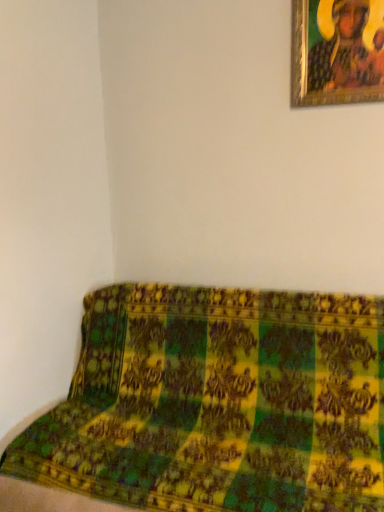
Question: Is green fabric couch at lower right at the right side of gold-framed painting at upper right?

Choices:
 (A) yes
 (B) no

Answer: (B)

Question: Is green fabric couch at lower right far from gold-framed painting at upper right?

Choices:
 (A) yes
 (B) no

Answer: (A)

Question: Can you confirm if green fabric couch at lower right is positioned to the left of gold-framed painting at upper right?

Choices:
 (A) yes
 (B) no

Answer: (A)

Question: Is green fabric couch at lower right next to gold-framed painting at upper right and touching it?

Choices:
 (A) yes
 (B) no

Answer: (B)

Question: From a real-world perspective, does green fabric couch at lower right stand above gold-framed painting at upper right?

Choices:
 (A) no
 (B) yes

Answer: (A)

Question: Does green fabric couch at lower right have a lesser width compared to gold-framed painting at upper right?

Choices:
 (A) no
 (B) yes

Answer: (A)

Question: Is gold-framed painting at upper right not inside green fabric couch at lower right?

Choices:
 (A) no
 (B) yes

Answer: (B)

Question: Does gold-framed painting at upper right have a smaller size compared to green fabric couch at lower right?

Choices:
 (A) no
 (B) yes

Answer: (B)

Question: Considering the relative sizes of gold-framed painting at upper right and green fabric couch at lower right in the image provided, is gold-framed painting at upper right thinner than green fabric couch at lower right?

Choices:
 (A) no
 (B) yes

Answer: (B)

Question: Is gold-framed painting at upper right turned away from green fabric couch at lower right?

Choices:
 (A) no
 (B) yes

Answer: (A)

Question: From the image's perspective, does gold-framed painting at upper right appear higher than green fabric couch at lower right?

Choices:
 (A) no
 (B) yes

Answer: (B)

Question: From a real-world perspective, is gold-framed painting at upper right over green fabric couch at lower right?

Choices:
 (A) yes
 (B) no

Answer: (A)

Question: Considering the relative positions of gold-framed painting at upper right and green fabric couch at lower right in the image provided, is gold-framed painting at upper right to the left or to the right of green fabric couch at lower right?

Choices:
 (A) right
 (B) left

Answer: (A)